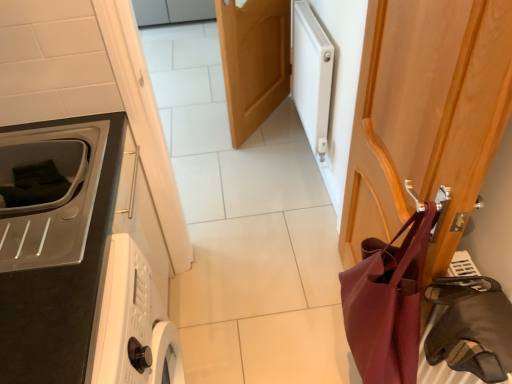
Question: Is white matte radiator at upper right completely or partially inside matte black microwave at left?

Choices:
 (A) no
 (B) yes

Answer: (A)

Question: Is matte black microwave at left aimed at white matte radiator at upper right?

Choices:
 (A) no
 (B) yes

Answer: (A)

Question: Is matte black microwave at left not inside white matte radiator at upper right?

Choices:
 (A) no
 (B) yes

Answer: (B)

Question: Considering the relative positions of matte black microwave at left and white matte radiator at upper right in the image provided, is matte black microwave at left to the right of white matte radiator at upper right from the viewer's perspective?

Choices:
 (A) yes
 (B) no

Answer: (B)

Question: Can you confirm if matte black microwave at left is bigger than white matte radiator at upper right?

Choices:
 (A) yes
 (B) no

Answer: (B)

Question: From the image's perspective, is wooden door at center, which appears as the 1th door when viewed from the left, located above or below matte burgundy leather shoulder bag at right?

Choices:
 (A) below
 (B) above

Answer: (B)

Question: Based on their sizes in the image, would you say wooden door at center, which is counted as the 1th door, starting from the back, is bigger or smaller than matte burgundy leather shoulder bag at right?

Choices:
 (A) big
 (B) small

Answer: (A)

Question: Relative to matte burgundy leather shoulder bag at right, is wooden door at center, which is counted as the 1th door, starting from the back, in front or behind?

Choices:
 (A) behind
 (B) front

Answer: (A)

Question: Is wooden door at center, marked as the second door in a right-to-left arrangement, situated inside matte burgundy leather shoulder bag at right or outside?

Choices:
 (A) outside
 (B) inside

Answer: (A)

Question: From the image's perspective, is matte black microwave at left positioned above or below leather-like brown bag at right?

Choices:
 (A) above
 (B) below

Answer: (A)

Question: Looking at the image, does matte black microwave at left seem bigger or smaller compared to leather-like brown bag at right?

Choices:
 (A) small
 (B) big

Answer: (B)

Question: Is matte black microwave at left spatially inside leather-like brown bag at right, or outside of it?

Choices:
 (A) outside
 (B) inside

Answer: (A)

Question: Considering the positions of point (104, 233) and point (466, 347), is point (104, 233) closer or farther from the camera than point (466, 347)?

Choices:
 (A) closer
 (B) farther

Answer: (B)

Question: Is matte burgundy leather shoulder bag at right taller or shorter than matte black microwave at left?

Choices:
 (A) tall
 (B) short

Answer: (A)

Question: Do you think matte burgundy leather shoulder bag at right is within matte black microwave at left, or outside of it?

Choices:
 (A) inside
 (B) outside

Answer: (B)